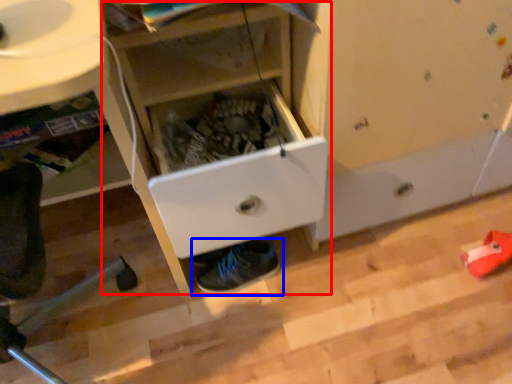
Question: Which of the following is the closest to the observer, cabinetry (highlighted by a red box) or footwear (highlighted by a blue box)?

Choices:
 (A) cabinetry
 (B) footwear

Answer: (A)